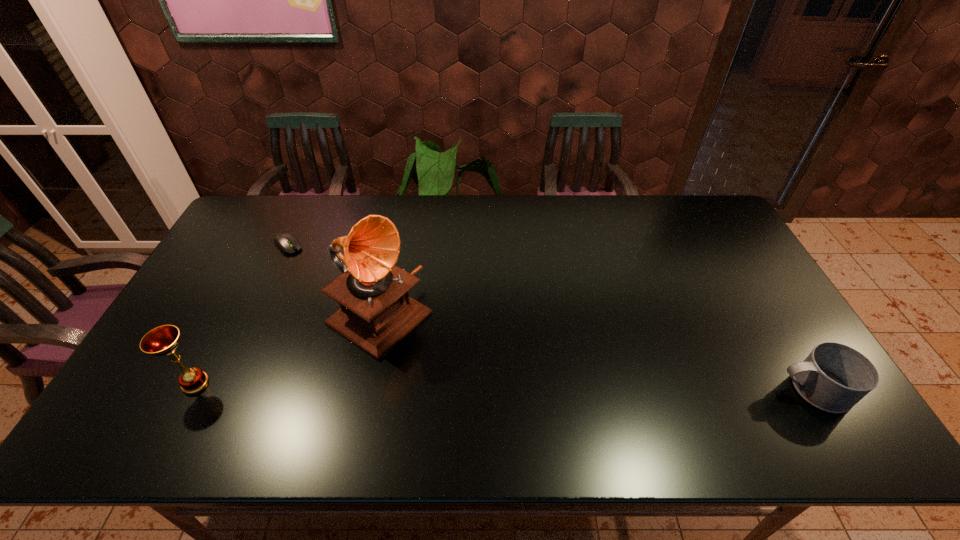
You are a GUI agent. You are given a task and a screenshot of the screen. Output one action in this format:
    pyautogui.click(x=<x>, y=<y>)
    Task: Click on the free space located on the side of the second shortest object with the handle
    
    Given the screenshot: What is the action you would take?
    pyautogui.click(x=694, y=389)

At what (x,y) coordinates should I click in order to perform the action: click on vacant space situated 0.160m on the horn of the third nearest object. Please return your answer as a coordinate pair (x, y). The height and width of the screenshot is (540, 960). Looking at the image, I should click on (465, 373).

Where is `free space located on the horn of the third nearest object`? free space located on the horn of the third nearest object is located at coordinates (441, 357).

At what (x,y) coordinates should I click in order to perform the action: click on vacant space located 0.070m on the horn of the third nearest object. Please return your answer as a coordinate pair (x, y). This screenshot has width=960, height=540. Looking at the image, I should click on (438, 356).

The width and height of the screenshot is (960, 540). Find the location of `vacant space situated on the wheel side of the shortest object`. vacant space situated on the wheel side of the shortest object is located at coordinates (372, 315).

Identify the location of vacant point located on the wheel side of the shortest object. (358, 302).

Identify the location of vacant position located on the wheel side of the shortest object. The width and height of the screenshot is (960, 540). (346, 292).

You are a GUI agent. You are given a task and a screenshot of the screen. Output one action in this format:
    pyautogui.click(x=<x>, y=<y>)
    Task: Click on the object at the far edge
    
    Given the screenshot: What is the action you would take?
    click(285, 242)

Locate an element on the screen. This screenshot has height=540, width=960. chalice that is at the near edge is located at coordinates (163, 340).

What are the coordinates of `mug positioned at the near edge` in the screenshot? It's located at (834, 377).